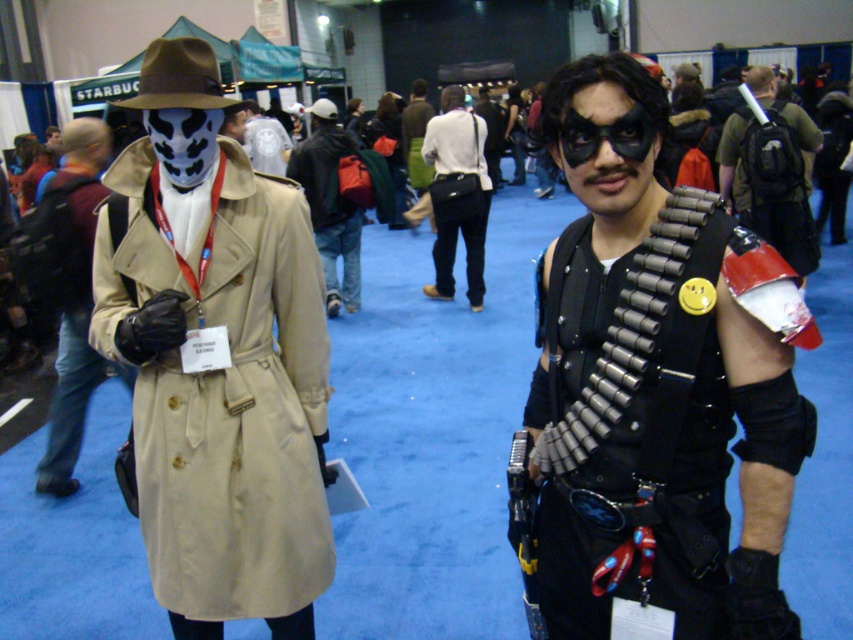
You are a photographer at the event and want to capture both the metallic bullet belt at center and the white cotton shirt at center in a single shot. Given that your camera has a maximum focus range of 3 meters, will you be able to do so?

The metallic bullet belt at center is 4.06 meters from the white cotton shirt at center. Since the distance exceeds the camera maximum focus range of 3 meters, you won that be able to capture both in a single shot.

You are a photographer at the event and need to capture a photo of the metallic bullet belt at center. The belt is 3.38 feet away from you. Can you reach it with your 100mm lens if your camera has a 50mm lens as standard?

The metallic bullet belt at center is 3.38 feet away. A 100mm lens has a narrower field of view than a 50mm lens, allowing you to zoom in on distant objects. Since the belt is only 3.38 feet away, the 100mm lens should provide sufficient magnification to capture the belt clearly without needing to move closer.

You are a photographer at the event and need to position a light to the right of both the metallic bullet belt at center and the matte black trench coat at center. Is this possible based on their current positions?

The metallic bullet belt at center is to the right of the matte black trench coat at center, so positioning a light to the right of both would require placing it further right than the metallic bullet belt at center.